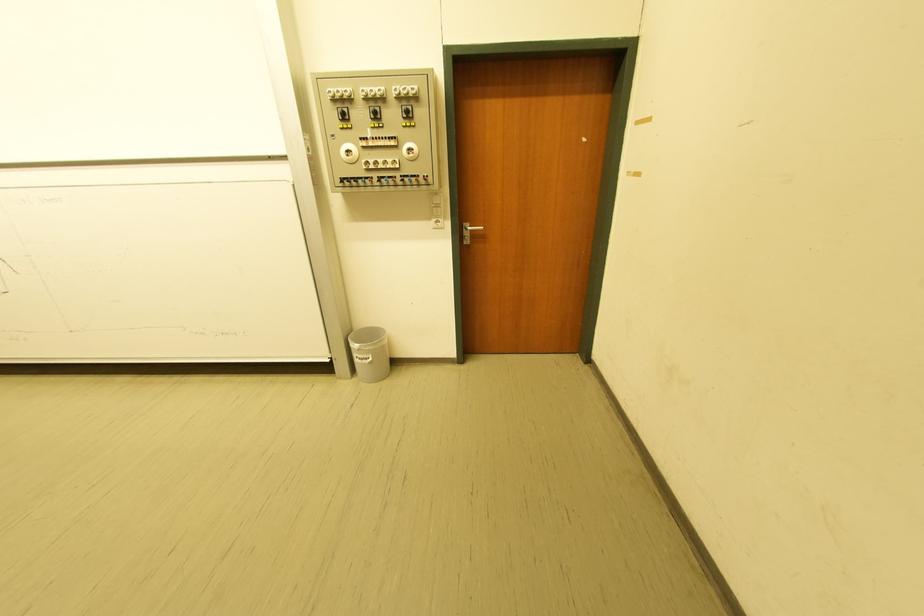
Where is `white control dial`? white control dial is located at coordinates (348, 153).